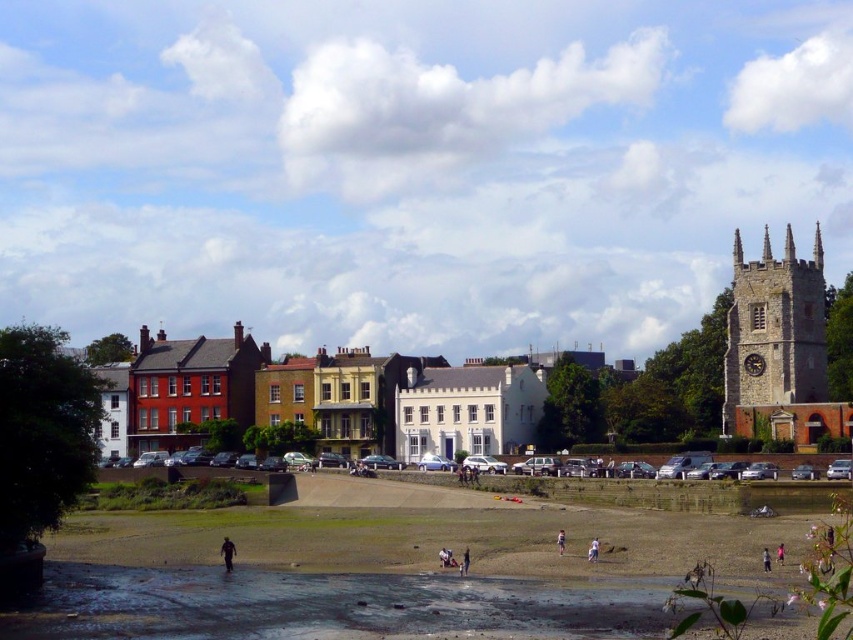
Question: Which of the following is the closest to the observer?

Choices:
 (A) (733, 428)
 (B) (561, 541)

Answer: (B)

Question: Can you confirm if green grass park at lower center is thinner than stone clock tower at upper right?

Choices:
 (A) no
 (B) yes

Answer: (A)

Question: Which object is closer to the camera taking this photo?

Choices:
 (A) light brown wooden stick at lower center
 (B) pink fabric person at lower right
 (C) light brown leather jacket at lower center

Answer: (A)

Question: Is green grass park at lower center further to camera compared to light brown leather jacket at lower center?

Choices:
 (A) yes
 (B) no

Answer: (B)

Question: Which of these objects is positioned farthest from the light brown leather jacket at lower center?

Choices:
 (A) green grass park at lower center
 (B) stone clock tower at upper right
 (C) dark brown leather jacket at lower center

Answer: (B)

Question: Is light brown wooden stick at lower center further to camera compared to pink fabric person at lower right?

Choices:
 (A) yes
 (B) no

Answer: (B)